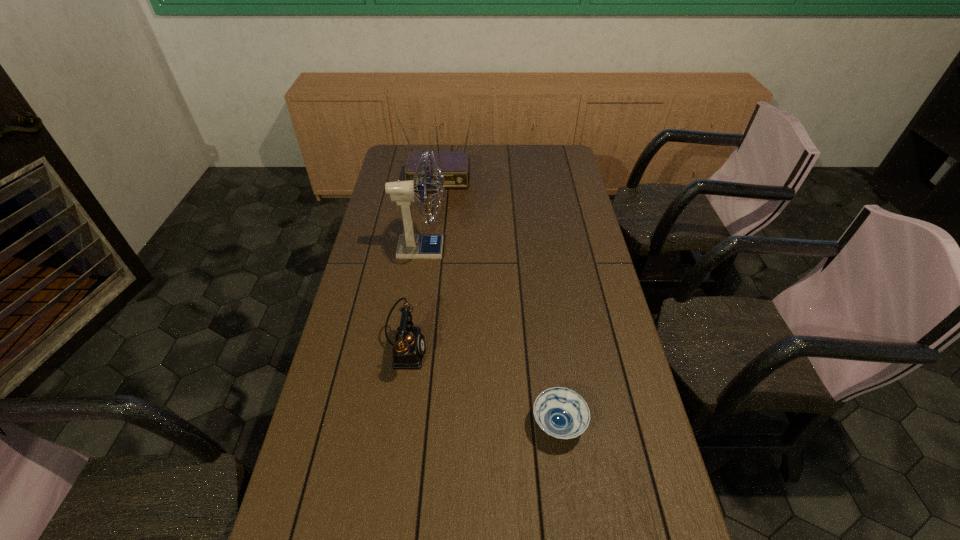
Identify the location of fan. (410, 246).

Where is `the third nearest object`? the third nearest object is located at coordinates (410, 246).

The height and width of the screenshot is (540, 960). In order to click on the farthest object in this screenshot , I will do `click(455, 166)`.

I want to click on the second tallest object, so click(455, 166).

This screenshot has height=540, width=960. I want to click on the second shortest object, so click(x=408, y=351).

Where is `the second nearest object`? The width and height of the screenshot is (960, 540). the second nearest object is located at coordinates (408, 351).

The image size is (960, 540). Identify the location of the nearest object. (562, 413).

The image size is (960, 540). Find the location of `the rightmost object`. the rightmost object is located at coordinates (562, 413).

Locate an element on the screen. This screenshot has height=540, width=960. vacant space situated on the front-facing side of the tallest object is located at coordinates (505, 249).

The width and height of the screenshot is (960, 540). Identify the location of blank space located 0.140m on the front panel of the second tallest object. [x=433, y=210].